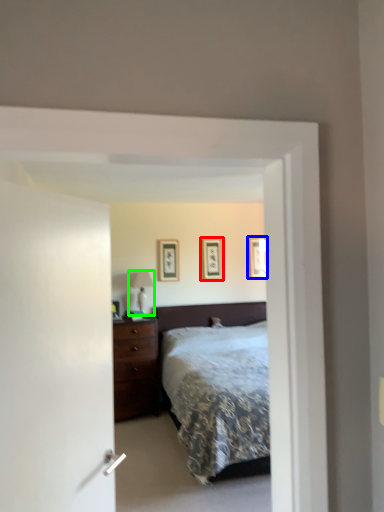
Question: Estimate the real-world distances between objects in this image. Which object is farther from picture frame (highlighted by a red box), picture frame (highlighted by a blue box) or table lamp (highlighted by a green box)?

Choices:
 (A) picture frame
 (B) table lamp

Answer: (B)